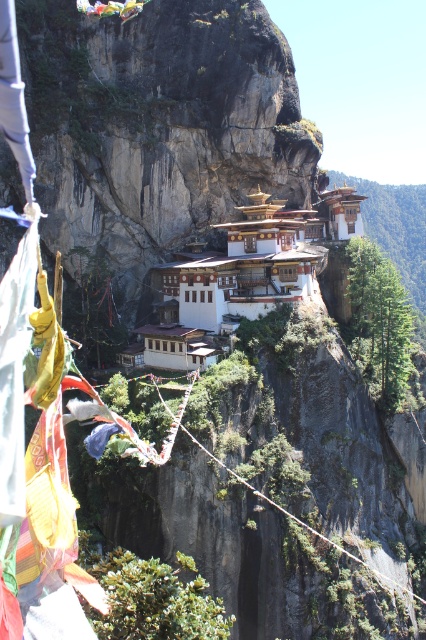
You are a tourist planning to cross the rope bridge at center to visit the white painted wood monastery at center. Based on the scene, which structure is wider?

The white painted wood monastery at center is wider than the rope bridge at center, as its width surpasses the rope bridge at center.

You are a tourist planning to visit the white painted wood monastery at center. You notice the rope bridge at center is the only path to reach it. Considering the size difference between them, which structure is more likely to be stable for your visit?

The white painted wood monastery at center is larger and therefore more stable than the rope bridge at center, making it the safer option for your visit.